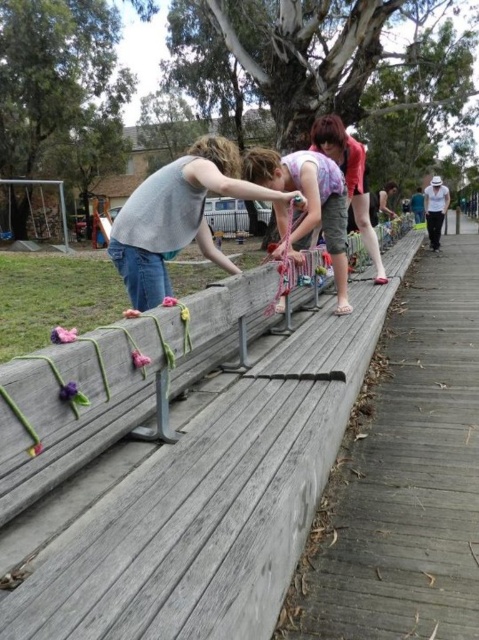
Question: Can you confirm if matte gray tank top at center is positioned above light pink fabric at center?

Choices:
 (A) no
 (B) yes

Answer: (B)

Question: Which point appears closest to the camera in this image?

Choices:
 (A) (180, 186)
 (B) (333, 189)
 (C) (361, 164)

Answer: (A)

Question: Which point is closer to the camera?

Choices:
 (A) pastel floral dress at center
 (B) matte gray tank top at center
 (C) light pink fabric at center

Answer: (B)

Question: Which of the following is the closest to the observer?

Choices:
 (A) matte gray tank top at center
 (B) pastel floral dress at center

Answer: (A)

Question: Is matte gray tank top at center smaller than light pink fabric at center?

Choices:
 (A) no
 (B) yes

Answer: (A)

Question: Is the position of matte gray tank top at center more distant than that of light pink fabric at center?

Choices:
 (A) yes
 (B) no

Answer: (B)